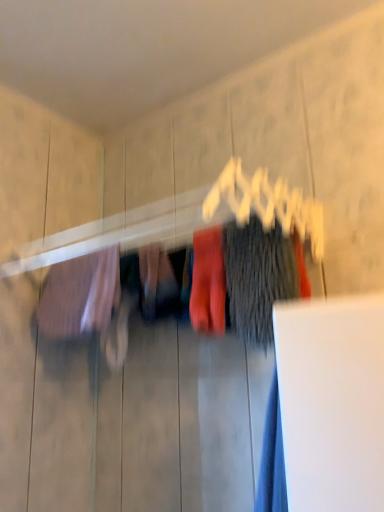
Describe the element at coordinates (80, 295) in the screenshot. I see `matte pink fabric at left, marked as the first clothing in a left-to-right arrangement` at that location.

This screenshot has width=384, height=512. What do you see at coordinates (208, 282) in the screenshot?
I see `matte red socks at center, the 2th clothing in the left-to-right sequence` at bounding box center [208, 282].

The height and width of the screenshot is (512, 384). Identify the location of dark gray fuzzy sweater at center, acting as the 1th clothing starting from the right. (257, 278).

Is matte pink fabric at left, which is the third clothing in right-to-left order, situated inside dark gray fuzzy sweater at center, acting as the 1th clothing starting from the right, or outside?

matte pink fabric at left, which is the third clothing in right-to-left order, lies outside dark gray fuzzy sweater at center, acting as the 1th clothing starting from the right.

Which object is thinner, matte pink fabric at left, marked as the first clothing in a left-to-right arrangement, or dark gray fuzzy sweater at center, acting as the 1th clothing starting from the right?

With smaller width is dark gray fuzzy sweater at center, acting as the 1th clothing starting from the right.

Is matte pink fabric at left, which is the third clothing in right-to-left order, positioned with its back to dark gray fuzzy sweater at center, placed as the 3th clothing when sorted from left to right?

No, matte pink fabric at left, which is the third clothing in right-to-left order, is not facing the opposite direction of dark gray fuzzy sweater at center, placed as the 3th clothing when sorted from left to right.

Is matte pink fabric at left, marked as the first clothing in a left-to-right arrangement, in front of or behind dark gray fuzzy sweater at center, acting as the 1th clothing starting from the right, in the image?

Visually, matte pink fabric at left, marked as the first clothing in a left-to-right arrangement, is located behind dark gray fuzzy sweater at center, acting as the 1th clothing starting from the right.

Would you say matte pink fabric at left, which is the third clothing in right-to-left order, is inside or outside matte red socks at center, the 2th clothing in the left-to-right sequence?

The correct answer is: outside.

This screenshot has width=384, height=512. Identify the location of clothing on the left of matte red socks at center, which is the 2th clothing from right to left. (x=80, y=295).

In the scene shown: Is matte pink fabric at left, marked as the first clothing in a left-to-right arrangement, in front of matte red socks at center, which is the 2th clothing from right to left?

No, matte pink fabric at left, marked as the first clothing in a left-to-right arrangement, is behind matte red socks at center, which is the 2th clothing from right to left.

Considering the relative sizes of matte pink fabric at left, which is the third clothing in right-to-left order, and matte red socks at center, which is the 2th clothing from right to left, in the image provided, is matte pink fabric at left, which is the third clothing in right-to-left order, wider than matte red socks at center, which is the 2th clothing from right to left,?

Indeed, matte pink fabric at left, which is the third clothing in right-to-left order, has a greater width compared to matte red socks at center, which is the 2th clothing from right to left.

Between point (263, 256) and point (53, 277), which one is positioned in front?

The point (263, 256) is closer.

From the image's perspective, would you say dark gray fuzzy sweater at center, placed as the 3th clothing when sorted from left to right, is positioned over matte pink fabric at left, which is the third clothing in right-to-left order?

Correct, dark gray fuzzy sweater at center, placed as the 3th clothing when sorted from left to right, appears higher than matte pink fabric at left, which is the third clothing in right-to-left order, in the image.

Is dark gray fuzzy sweater at center, placed as the 3th clothing when sorted from left to right, outside of matte pink fabric at left, marked as the first clothing in a left-to-right arrangement?

That's correct, dark gray fuzzy sweater at center, placed as the 3th clothing when sorted from left to right, is outside of matte pink fabric at left, marked as the first clothing in a left-to-right arrangement.

How distant is dark gray fuzzy sweater at center, placed as the 3th clothing when sorted from left to right, from matte pink fabric at left, which is the third clothing in right-to-left order?

dark gray fuzzy sweater at center, placed as the 3th clothing when sorted from left to right, is 14.77 inches from matte pink fabric at left, which is the third clothing in right-to-left order.

Is matte red socks at center, which is the 2th clothing from right to left, further to camera compared to matte pink fabric at left, which is the third clothing in right-to-left order?

No, matte red socks at center, which is the 2th clothing from right to left, is in front of matte pink fabric at left, which is the third clothing in right-to-left order.

Is point (196, 290) behind point (73, 310)?

No.

From a real-world perspective, is matte red socks at center, which is the 2th clothing from right to left, physically below matte pink fabric at left, which is the third clothing in right-to-left order?

Yes, from a real-world perspective, matte red socks at center, which is the 2th clothing from right to left, is beneath matte pink fabric at left, which is the third clothing in right-to-left order.

From the image's perspective, which one is positioned lower, matte red socks at center, the 2th clothing in the left-to-right sequence, or matte pink fabric at left, which is the third clothing in right-to-left order?

matte pink fabric at left, which is the third clothing in right-to-left order, is shown below in the image.

Does matte red socks at center, the 2th clothing in the left-to-right sequence, turn towards dark gray fuzzy sweater at center, placed as the 3th clothing when sorted from left to right?

No, matte red socks at center, the 2th clothing in the left-to-right sequence, is not facing towards dark gray fuzzy sweater at center, placed as the 3th clothing when sorted from left to right.

Is matte red socks at center, which is the 2th clothing from right to left, at the left side of dark gray fuzzy sweater at center, placed as the 3th clothing when sorted from left to right?

Yes, matte red socks at center, which is the 2th clothing from right to left, is to the left of dark gray fuzzy sweater at center, placed as the 3th clothing when sorted from left to right.

Where is `clothing lying in front of the matte red socks at center, which is the 2th clothing from right to left`? This screenshot has height=512, width=384. clothing lying in front of the matte red socks at center, which is the 2th clothing from right to left is located at coordinates (257, 278).

In the scene shown: Considering the sizes of objects dark gray fuzzy sweater at center, acting as the 1th clothing starting from the right, and matte red socks at center, which is the 2th clothing from right to left, in the image provided, who is taller, dark gray fuzzy sweater at center, acting as the 1th clothing starting from the right, or matte red socks at center, which is the 2th clothing from right to left,?

Standing taller between the two is dark gray fuzzy sweater at center, acting as the 1th clothing starting from the right.

Looking at their sizes, would you say dark gray fuzzy sweater at center, placed as the 3th clothing when sorted from left to right, is wider or thinner than matte red socks at center, the 2th clothing in the left-to-right sequence?

Clearly, dark gray fuzzy sweater at center, placed as the 3th clothing when sorted from left to right, has less width compared to matte red socks at center, the 2th clothing in the left-to-right sequence.

Are dark gray fuzzy sweater at center, acting as the 1th clothing starting from the right, and matte red socks at center, the 2th clothing in the left-to-right sequence, beside each other?

Yes, dark gray fuzzy sweater at center, acting as the 1th clothing starting from the right, is next to matte red socks at center, the 2th clothing in the left-to-right sequence.

Which object is more forward, dark gray fuzzy sweater at center, placed as the 3th clothing when sorted from left to right, or matte red socks at center, which is the 2th clothing from right to left?

dark gray fuzzy sweater at center, placed as the 3th clothing when sorted from left to right, is more forward.

What are the coordinates of `the 2nd clothing to the left when counting from the dark gray fuzzy sweater at center, placed as the 3th clothing when sorted from left to right` in the screenshot? It's located at (80, 295).

Identify the location of clothing behind the matte red socks at center, which is the 2th clothing from right to left. The image size is (384, 512). (80, 295).

Which object lies nearer to the anchor point dark gray fuzzy sweater at center, acting as the 1th clothing starting from the right, matte pink fabric at left, which is the third clothing in right-to-left order, or matte red socks at center, which is the 2th clothing from right to left?

matte red socks at center, which is the 2th clothing from right to left, lies closer to dark gray fuzzy sweater at center, acting as the 1th clothing starting from the right, than the other object.

When comparing their distances from matte red socks at center, which is the 2th clothing from right to left, does dark gray fuzzy sweater at center, placed as the 3th clothing when sorted from left to right, or matte pink fabric at left, marked as the first clothing in a left-to-right arrangement, seem further?

matte pink fabric at left, marked as the first clothing in a left-to-right arrangement, lies further to matte red socks at center, which is the 2th clothing from right to left, than the other object.

From the image, which object appears to be nearer to matte pink fabric at left, which is the third clothing in right-to-left order, dark gray fuzzy sweater at center, placed as the 3th clothing when sorted from left to right, or matte red socks at center, which is the 2th clothing from right to left?

The object closer to matte pink fabric at left, which is the third clothing in right-to-left order, is matte red socks at center, which is the 2th clothing from right to left.

Considering their positions, is matte red socks at center, the 2th clothing in the left-to-right sequence, positioned further to dark gray fuzzy sweater at center, placed as the 3th clothing when sorted from left to right, than matte pink fabric at left, marked as the first clothing in a left-to-right arrangement?

The object further to dark gray fuzzy sweater at center, placed as the 3th clothing when sorted from left to right, is matte pink fabric at left, marked as the first clothing in a left-to-right arrangement.

Which object lies further to the anchor point matte pink fabric at left, which is the third clothing in right-to-left order, matte red socks at center, which is the 2th clothing from right to left, or dark gray fuzzy sweater at center, placed as the 3th clothing when sorted from left to right?

dark gray fuzzy sweater at center, placed as the 3th clothing when sorted from left to right.

Looking at the image, which one is located closer to matte red socks at center, which is the 2th clothing from right to left, matte pink fabric at left, which is the third clothing in right-to-left order, or dark gray fuzzy sweater at center, acting as the 1th clothing starting from the right?

The object closer to matte red socks at center, which is the 2th clothing from right to left, is dark gray fuzzy sweater at center, acting as the 1th clothing starting from the right.

Identify the location of clothing situated between matte pink fabric at left, which is the third clothing in right-to-left order, and dark gray fuzzy sweater at center, acting as the 1th clothing starting from the right, from left to right. This screenshot has width=384, height=512. (208, 282).